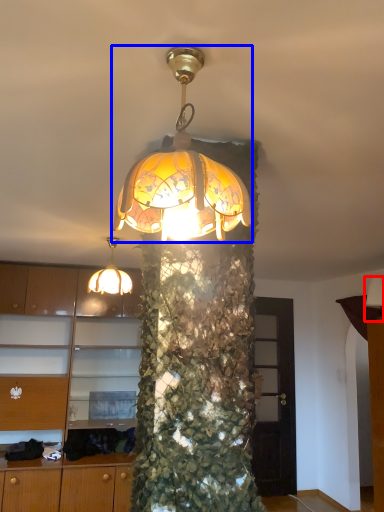
Question: Which point is closer to the camera, lamp (highlighted by a red box) or lamp (highlighted by a blue box)?

Choices:
 (A) lamp
 (B) lamp

Answer: (B)